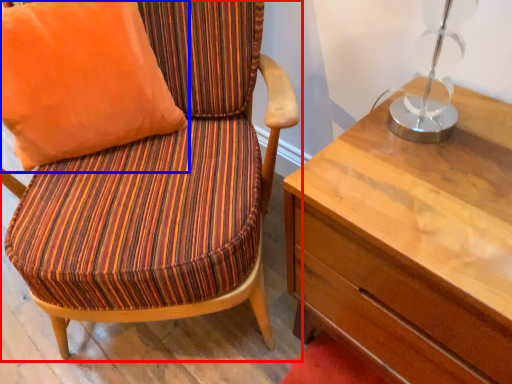
Question: Which of the following is the farthest to the observer, chair (highlighted by a red box) or pillow (highlighted by a blue box)?

Choices:
 (A) chair
 (B) pillow

Answer: (B)